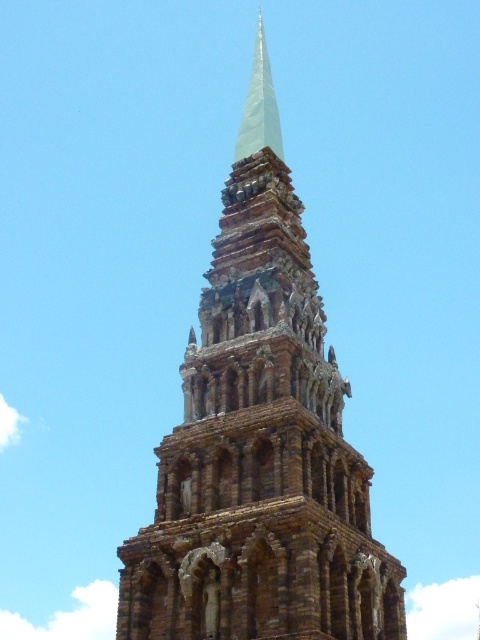
What are the coordinates of the brown stone tower at center?

The coordinates of the brown stone tower at center are point (260, 456).

You are an architect examining the brown stone tower at center and the white glass spire at center. Which structure has a greater height?

The white glass spire at center is taller than the brown stone tower at center, so the white glass spire at center has a greater height.

You are standing in front of the stupa and notice two points marked on its surface. The first point is located at coordinates point (213, 413), and the second at point (248, 156). Which of these points is closer to your viewpoint?

Point (213, 413) is closer to the camera than point (248, 156).